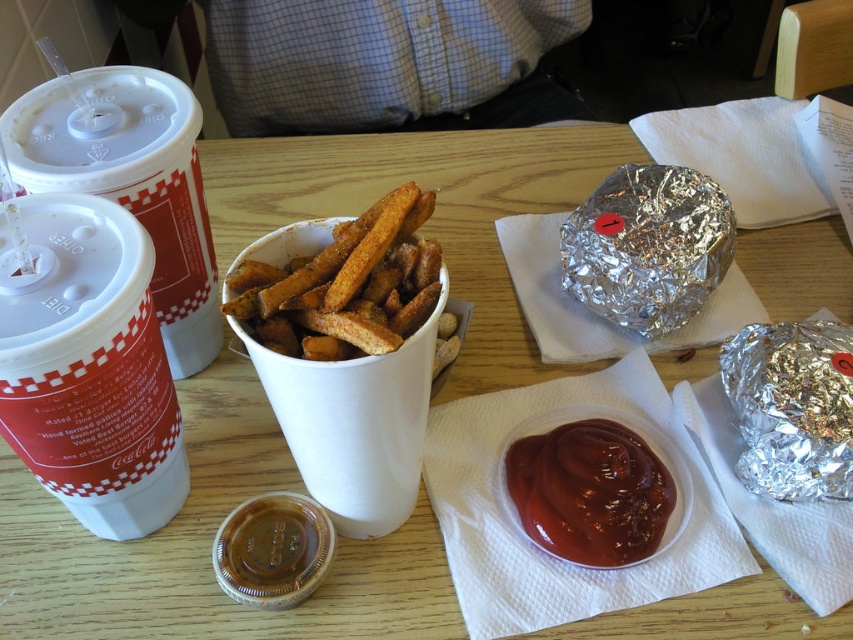
Question: Does white paper cup at left come in front of shiny red ketchup at center?

Choices:
 (A) yes
 (B) no

Answer: (A)

Question: Based on their relative distances, which object is farther from the golden crispy french fries at center?

Choices:
 (A) shiny red ketchup at center
 (B) white paper cup at left

Answer: (A)

Question: Observing the image, what is the correct spatial positioning of white plastic cup at upper left in reference to golden crispy french fries at center?

Choices:
 (A) right
 (B) left

Answer: (B)

Question: Among these objects, which one is farthest from the camera?

Choices:
 (A) shiny red ketchup at center
 (B) white paper cup at left
 (C) golden crispy french fries at center
 (D) white plastic cup at upper left

Answer: (A)

Question: Estimate the real-world distances between objects in this image. Which object is closer to the white paper cup at left?

Choices:
 (A) shiny red ketchup at center
 (B) white plastic cup at upper left
 (C) golden crispy french fries at center

Answer: (B)

Question: Where is white paper cup at left located in relation to white plastic cup at upper left in the image?

Choices:
 (A) below
 (B) above

Answer: (A)